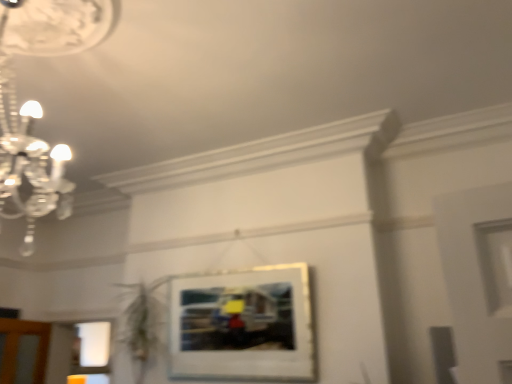
Question: Should I look upward or downward to see white matte picture frame at center?

Choices:
 (A) up
 (B) down

Answer: (B)